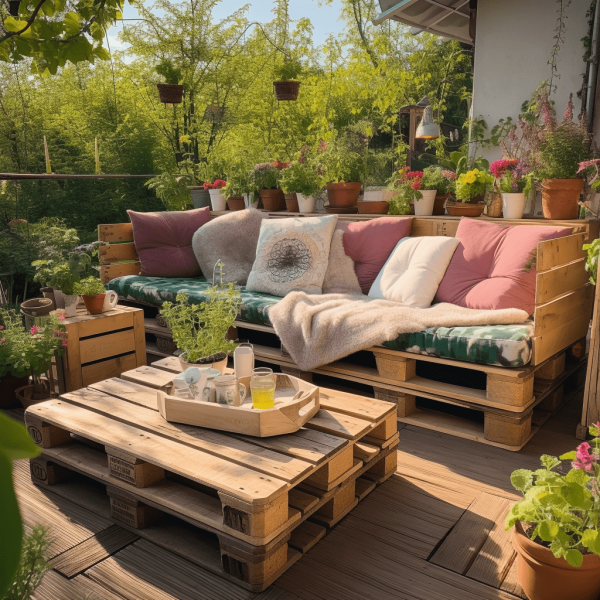
This screenshot has width=600, height=600. I want to click on wooden tray, so click(x=264, y=425).